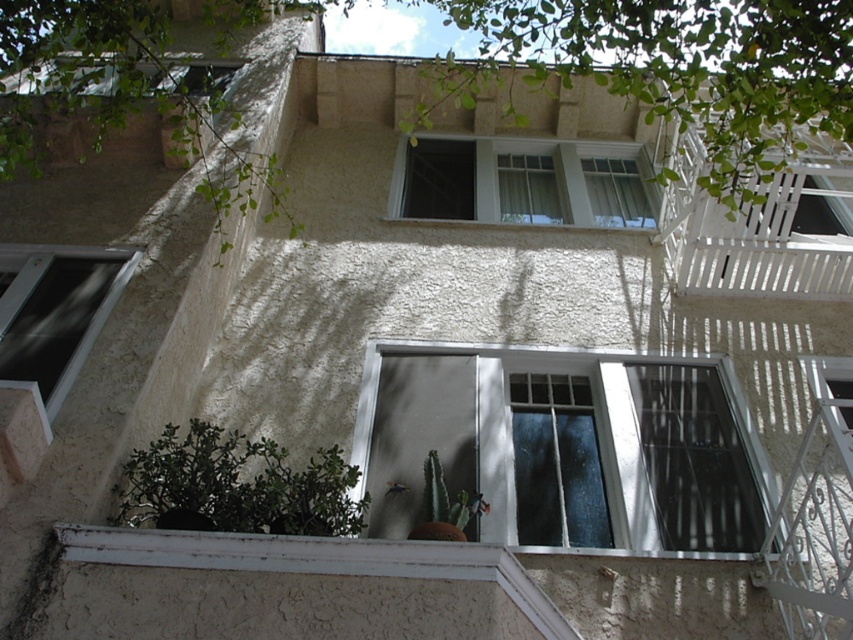
Question: Does white painted wood at lower center appear over matte black window at left?

Choices:
 (A) yes
 (B) no

Answer: (B)

Question: Which of these objects is positioned closest to the white painted wood at lower center?

Choices:
 (A) matte black window at left
 (B) green leafy tree at upper center
 (C) white textured window at upper center
 (D) green leafy tree at upper left

Answer: (A)

Question: Does green leafy tree at upper left appear under white painted wood at lower center?

Choices:
 (A) yes
 (B) no

Answer: (B)

Question: Does green leafy tree at upper center have a larger size compared to white painted wood balcony at upper right?

Choices:
 (A) no
 (B) yes

Answer: (A)

Question: Which point is farther to the camera?

Choices:
 (A) (461, 572)
 (B) (94, 148)
 (C) (416, 374)

Answer: (C)

Question: Among these objects, which one is farthest from the camera?

Choices:
 (A) white painted wood balcony at upper right
 (B) clear glass window at center
 (C) matte black window at left

Answer: (A)